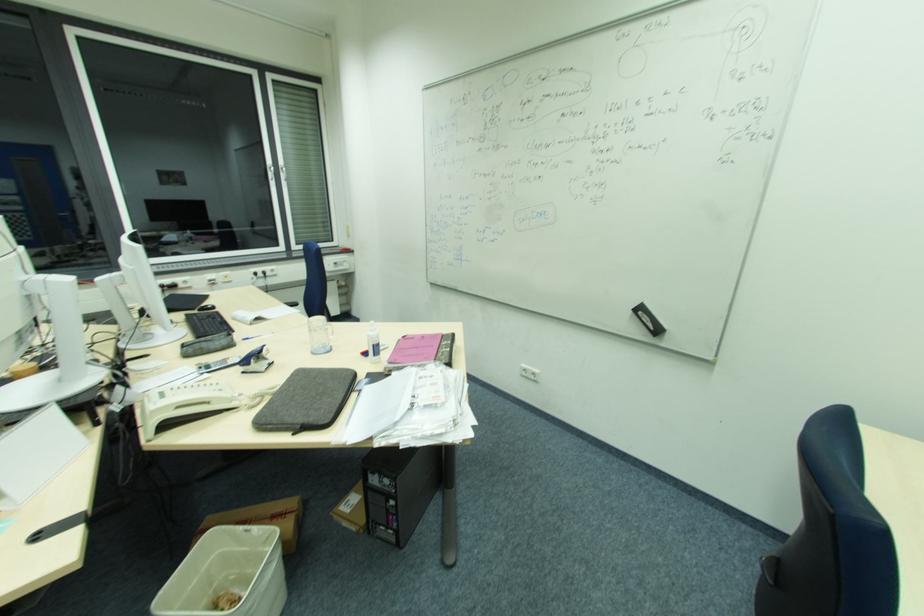
The height and width of the screenshot is (616, 924). I want to click on silver and blue stapler, so click(258, 362).